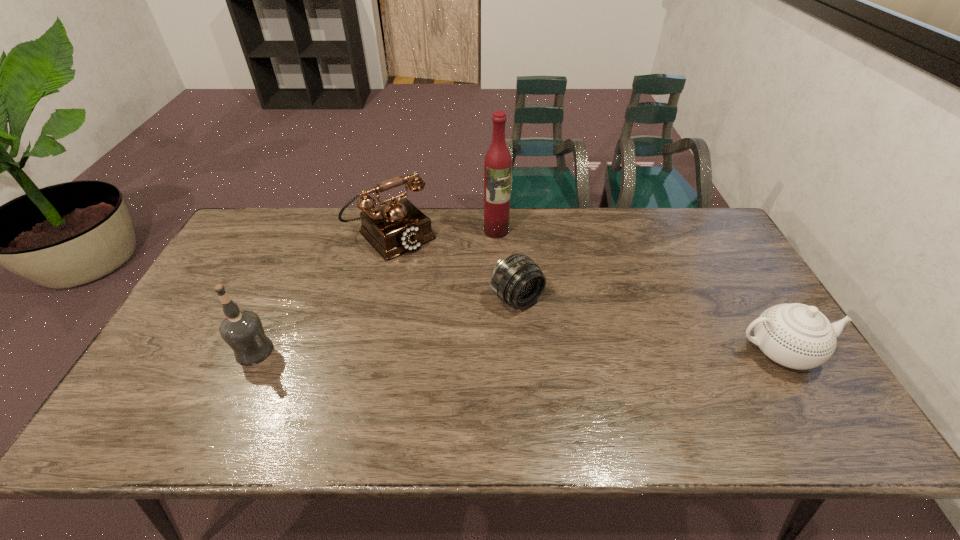
The width and height of the screenshot is (960, 540). I want to click on vacant space on the desktop that is between the leftmost object and the fourth tallest object and is positioned on the label of the tallest object, so click(537, 352).

Find the location of a particular element. free space on the desktop that is between the leftmost object and the chinaware and is positioned at the front element of the telephoto lens is located at coordinates (576, 352).

This screenshot has width=960, height=540. Identify the location of vacant space on the desktop that is between the leftmost object and the chinaware and is positioned on the dial of the second object from left to right. (504, 351).